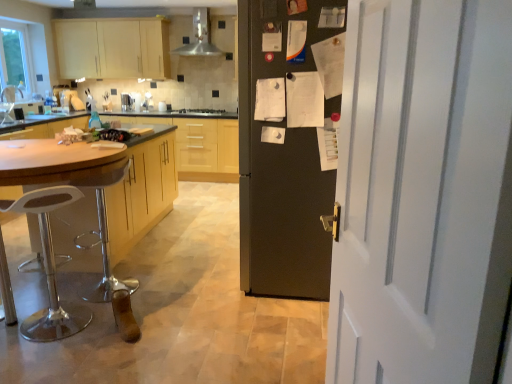
What is the approximate width of satin silver coffee machine at center?

satin silver coffee machine at center is 9.99 inches in width.

This screenshot has width=512, height=384. I want to click on matte black fridge at center, so click(x=281, y=167).

What do you see at coordinates (423, 193) in the screenshot?
I see `white painted wood door at right` at bounding box center [423, 193].

Image resolution: width=512 pixels, height=384 pixels. I want to click on matte wood cabinets at upper left, which is the first cabinetry from top to bottom, so click(112, 48).

This screenshot has width=512, height=384. Identify the location of satin silver coffee machine at center. pos(126,102).

Consider the image. From a real-world perspective, is wooden cabinet at center, acting as the 2th cabinetry starting from the back, beneath white painted wood door at right?

Yes.

Is the position of wooden cabinet at center, which is the 1th cabinetry from front to back, more distant than that of white painted wood door at right?

Yes, wooden cabinet at center, which is the 1th cabinetry from front to back, is further from the camera.

Would you say wooden cabinet at center, which is counted as the first cabinetry, starting from the bottom, is inside or outside white painted wood door at right?

wooden cabinet at center, which is counted as the first cabinetry, starting from the bottom, exists outside the volume of white painted wood door at right.

Would you say matte black fridge at center is a long distance from wooden cabinet at center, which is the 2th cabinetry from top to bottom?

That's right, there is a large distance between matte black fridge at center and wooden cabinet at center, which is the 2th cabinetry from top to bottom.

Between matte black fridge at center and wooden cabinet at center, which is the 1th cabinetry from front to back, which one has larger size?

With larger size is wooden cabinet at center, which is the 1th cabinetry from front to back.

Do you think matte black fridge at center is within wooden cabinet at center, which is counted as the first cabinetry, starting from the bottom, or outside of it?

matte black fridge at center is outside wooden cabinet at center, which is counted as the first cabinetry, starting from the bottom.

From the image's perspective, which one is positioned lower, matte black fridge at center or wooden cabinet at center, which is the 1th cabinetry from front to back?

From the image's view, wooden cabinet at center, which is the 1th cabinetry from front to back, is below.

Is point (248, 223) closer or farther from the camera than point (128, 110)?

Point (248, 223).

How much distance is there between matte black fridge at center and satin silver coffee machine at center?

matte black fridge at center and satin silver coffee machine at center are 4.19 meters apart.

From the image's perspective, is matte black fridge at center on satin silver coffee machine at center?

Incorrect, from the image's perspective, matte black fridge at center is lower than satin silver coffee machine at center.

How distant is black matte stove at center from matte black fridge at center?

black matte stove at center is 11.80 feet away from matte black fridge at center.

Is black matte stove at center looking in the opposite direction of matte black fridge at center?

black matte stove at center is not turned away from matte black fridge at center.

Can you confirm if black matte stove at center is wider than matte black fridge at center?

Incorrect, the width of black matte stove at center does not surpass that of matte black fridge at center.

What's the angular difference between black matte stove at center and matte black fridge at center's facing directions?

They differ by 88.5 degrees in their facing directions.

How much distance is there between wooden cabinet at center, acting as the 2th cabinetry starting from the back, and white plastic bar stool at left?

wooden cabinet at center, acting as the 2th cabinetry starting from the back, is 27.11 inches from white plastic bar stool at left.

Considering the relative positions of wooden cabinet at center, which is the 2th cabinetry from top to bottom, and white plastic bar stool at left in the image provided, is wooden cabinet at center, which is the 2th cabinetry from top to bottom, to the right of white plastic bar stool at left from the viewer's perspective?

In fact, wooden cabinet at center, which is the 2th cabinetry from top to bottom, is to the left of white plastic bar stool at left.

From the image's perspective, is wooden cabinet at center, which is counted as the first cabinetry, starting from the bottom, on white plastic bar stool at left?

Yes, from the image's perspective, wooden cabinet at center, which is counted as the first cabinetry, starting from the bottom, is over white plastic bar stool at left.

Locate an element on the screen. stove on the right of white plastic bar stool at left is located at coordinates (202, 112).

Does white plastic bar stool at left have a greater width compared to black matte stove at center?

No.

From the image's perspective, who appears lower, white plastic bar stool at left or black matte stove at center?

white plastic bar stool at left, from the image's perspective.

How many degrees apart are the facing directions of white plastic bar stool at left and black matte stove at center?

The angle between the facing direction of white plastic bar stool at left and the facing direction of black matte stove at center is 132 degrees.

Measure the distance between satin silver coffee machine at center and wooden cabinet at center, acting as the 2th cabinetry starting from the back.

A distance of 9.49 feet exists between satin silver coffee machine at center and wooden cabinet at center, acting as the 2th cabinetry starting from the back.

Is satin silver coffee machine at center turned away from wooden cabinet at center, which is counted as the first cabinetry, starting from the bottom?

That's not correct — satin silver coffee machine at center is not looking away from wooden cabinet at center, which is counted as the first cabinetry, starting from the bottom.

Which is in front, point (123, 96) or point (142, 161)?

The point (142, 161) is closer.

Can you confirm if satin silver coffee machine at center is bigger than wooden cabinet at center, which is counted as the first cabinetry, starting from the bottom?

No, satin silver coffee machine at center is not bigger than wooden cabinet at center, which is counted as the first cabinetry, starting from the bottom.

Locate an element on the screen. This screenshot has height=384, width=512. door lying on the right of wooden cabinet at center, which is the 2th cabinetry from top to bottom is located at coordinates (423, 193).

Which cabinetry is the 1st one when counting from the left side of the matte black fridge at center? Please provide its 2D coordinates.

[(142, 189)]

From the image, which object appears to be nearer to black matte stove at center, white painted wood door at right or satin silver coffee machine at center?

Based on the image, satin silver coffee machine at center appears to be nearer to black matte stove at center.

When comparing their distances from wooden cabinet at center, which is the 2th cabinetry from top to bottom, does white plastic bar stool at left or matte wood cabinets at upper left, the second cabinetry in the front-to-back sequence, seem closer?

white plastic bar stool at left is positioned closer to the anchor wooden cabinet at center, which is the 2th cabinetry from top to bottom.

Looking at the image, which one is located further to white painted wood door at right, white plastic bar stool at left or metallic stainless steel range hood at upper center?

metallic stainless steel range hood at upper center is further to white painted wood door at right.

When comparing their distances from satin silver coffee machine at center, does matte wood cabinets at upper left, positioned as the 1th cabinetry in back-to-front order, or white painted wood door at right seem further?

white painted wood door at right lies further to satin silver coffee machine at center than the other object.

Looking at the image, which one is located further to satin silver coffee machine at center, matte black fridge at center or wooden cabinet at center, acting as the 2th cabinetry starting from the back?

Among the two, matte black fridge at center is located further to satin silver coffee machine at center.

Estimate the real-world distances between objects in this image. Which object is further from white plastic bar stool at left, white painted wood door at right or matte wood cabinets at upper left, the 2th cabinetry in the bottom-to-top sequence?

matte wood cabinets at upper left, the 2th cabinetry in the bottom-to-top sequence, is positioned further to the anchor white plastic bar stool at left.

Considering their positions, is white plastic bar stool at left positioned closer to wooden cabinet at center, which is counted as the first cabinetry, starting from the bottom, than satin silver coffee machine at center?

white plastic bar stool at left.

Based on their spatial positions, is white painted wood door at right or satin silver coffee machine at center closer to metallic stainless steel range hood at upper center?

satin silver coffee machine at center lies closer to metallic stainless steel range hood at upper center than the other object.

Find the location of a particular element. bar stool positioned between white painted wood door at right and black matte stove at center from near to far is located at coordinates (50, 268).

Where is `kitchen appliance between matte black fridge at center and matte wood cabinets at upper left, the second cabinetry in the front-to-back sequence, in the front-back direction`? This screenshot has height=384, width=512. kitchen appliance between matte black fridge at center and matte wood cabinets at upper left, the second cabinetry in the front-to-back sequence, in the front-back direction is located at coordinates click(199, 37).

This screenshot has width=512, height=384. What are the coordinates of `cabinetry between wooden cabinet at center, which is counted as the first cabinetry, starting from the bottom, and satin silver coffee machine at center, along the z-axis` in the screenshot? It's located at (112, 48).

You are a GUI agent. You are given a task and a screenshot of the screen. Output one action in this format:
    pyautogui.click(x=<x>, y=<y>)
    Task: Click on the cabinetry located between matte black fridge at center and matte wood cabinets at upper left, the 2th cabinetry in the bottom-to-top sequence, in the depth direction
    The image size is (512, 384).
    Given the screenshot: What is the action you would take?
    pyautogui.click(x=142, y=189)